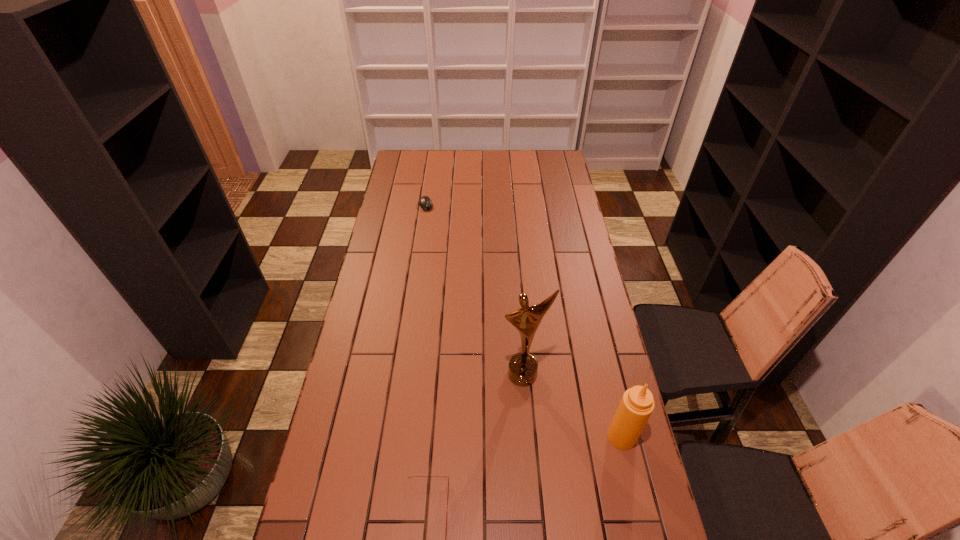
In order to click on free location at the far right corner of the desktop in this screenshot , I will do `click(541, 159)`.

Find the location of `free location at the near right corner`. free location at the near right corner is located at coordinates (597, 502).

The width and height of the screenshot is (960, 540). Find the location of `free space between the leftmost object and the third nearest object`. free space between the leftmost object and the third nearest object is located at coordinates (474, 289).

This screenshot has width=960, height=540. In order to click on vacant space that is in between the third nearest object and the second tallest object in this screenshot , I will do `click(572, 406)`.

Find the location of a particular element. The width and height of the screenshot is (960, 540). unoccupied position between the computer mouse and the tallest object is located at coordinates (474, 289).

Locate an element on the screen. The image size is (960, 540). object that is the closest to the award is located at coordinates pos(637,404).

Find the location of a particular element. object that is the closest one to the computer mouse is located at coordinates (522, 369).

Where is `vacant space that satisfies the following two spatial constraints: 1. on the front side of the rightmost object; 2. on the left side of the second object from right to left`? The image size is (960, 540). vacant space that satisfies the following two spatial constraints: 1. on the front side of the rightmost object; 2. on the left side of the second object from right to left is located at coordinates (528, 437).

Find the location of a particular element. blank area in the image that satisfies the following two spatial constraints: 1. on the front side of the computer mouse; 2. on the right side of the second nearest object is located at coordinates (392, 437).